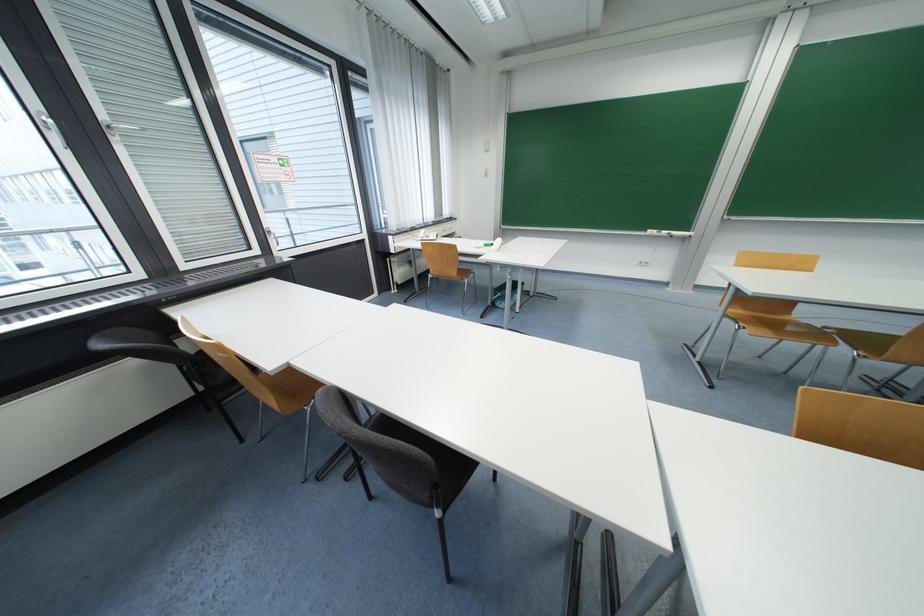
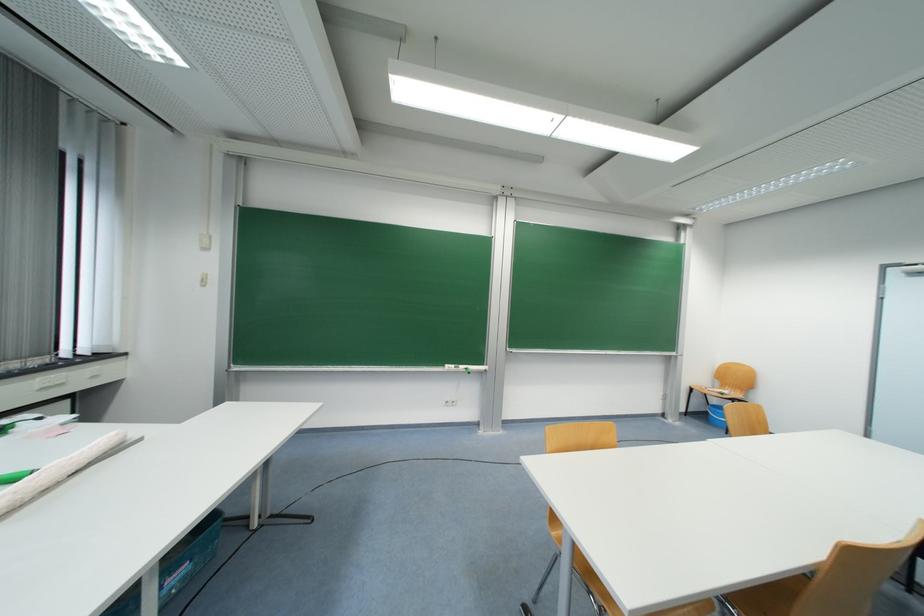
In the second image, find the point that corresponds to (648,265) in the first image.

(455, 406)